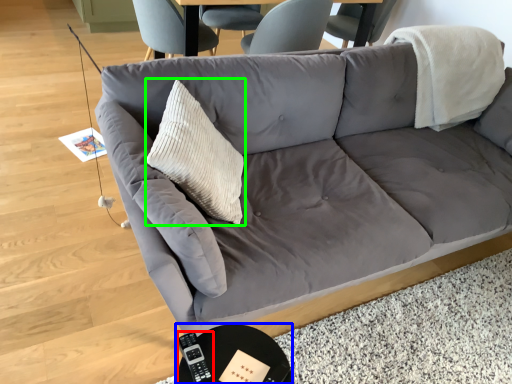
Question: Which is farther away from remote (highlighted by a red box)? round table (highlighted by a blue box) or throw pillow (highlighted by a green box)?

Choices:
 (A) round table
 (B) throw pillow

Answer: (B)